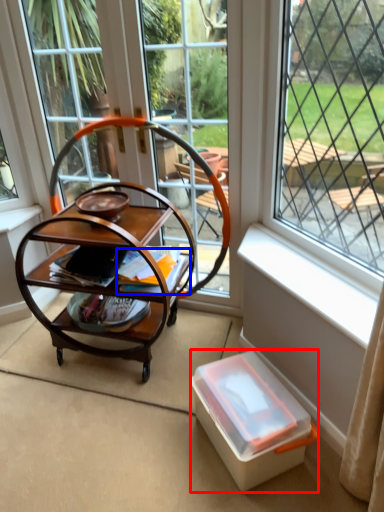
Question: Which object is further to the camera taking this photo, box (highlighted by a red box) or magazine (highlighted by a blue box)?

Choices:
 (A) box
 (B) magazine

Answer: (B)